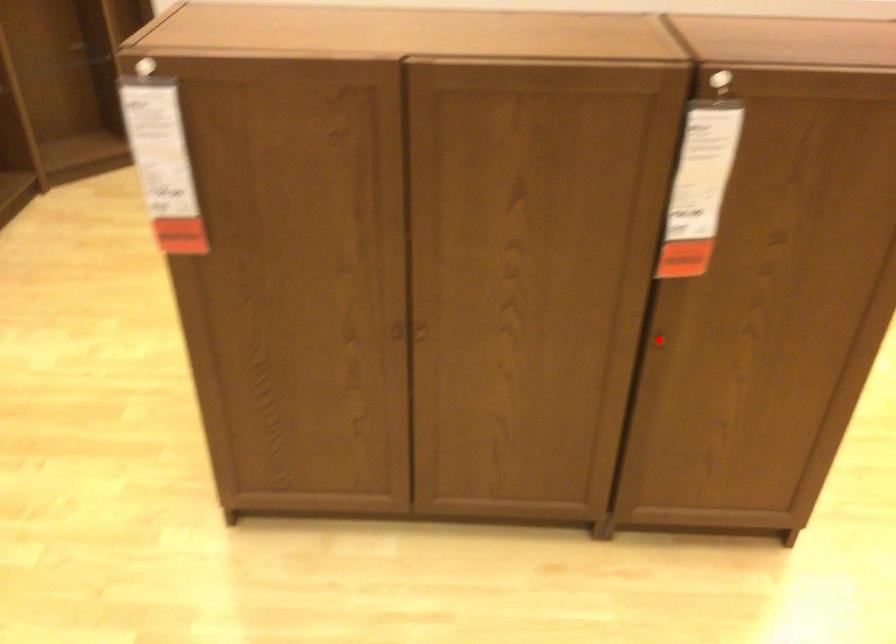
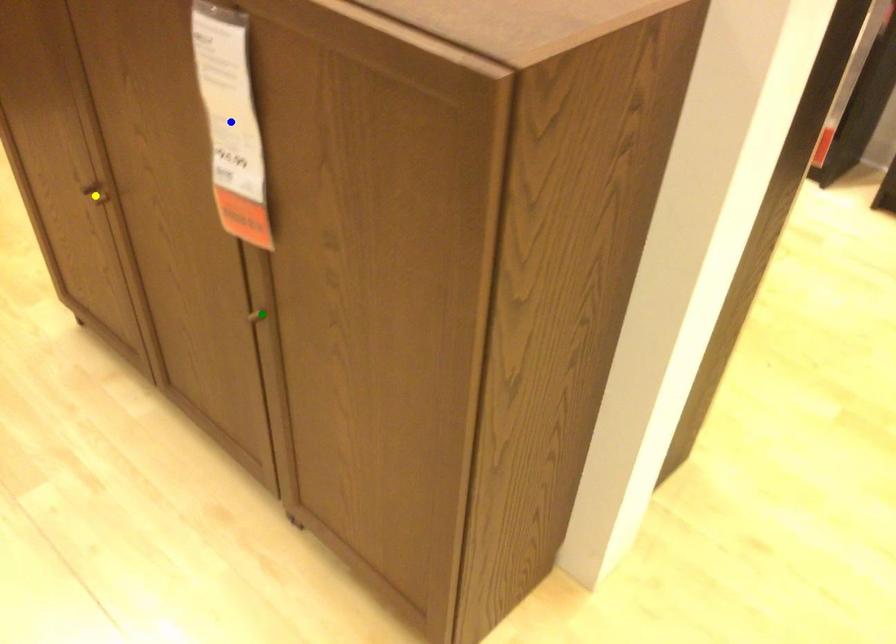
Question: I am providing you with two images of the same scene from different viewpoints. A red point is marked on the first image. You are given multiple points on the second image. Which mark in image 2 goes with the point in image 1?

Choices:
 (A) blue point
 (B) yellow point
 (C) green point

Answer: (C)